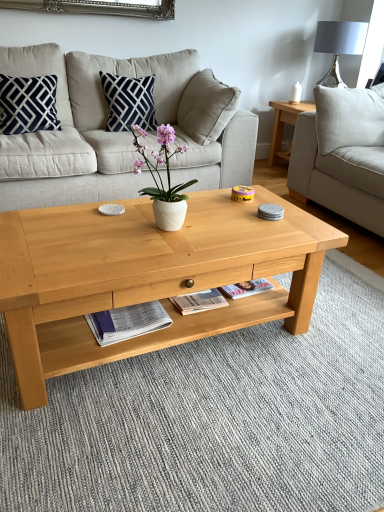
I want to click on unoccupied area in front of white matte vase at center, so click(154, 254).